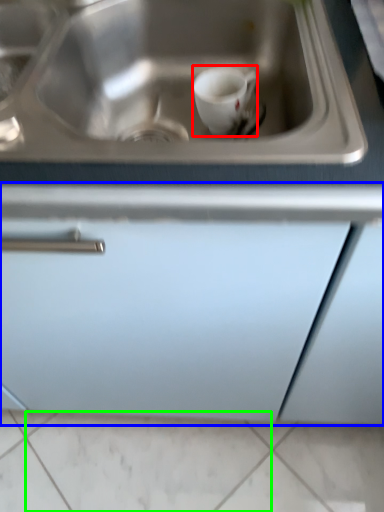
Question: Considering the real-world distances, which object is closest to coffee cup (highlighted by a red box)? cabinetry (highlighted by a blue box) or tile (highlighted by a green box).

Choices:
 (A) cabinetry
 (B) tile

Answer: (A)